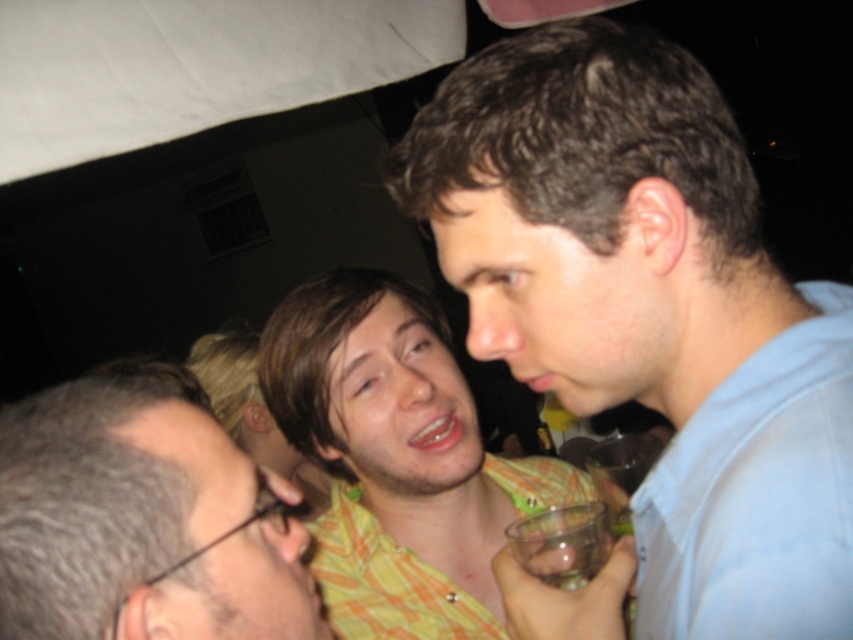
Which is above, blue cotton shirt at center or transparent plastic wine glass at lower center?

blue cotton shirt at center is above.

Does blue cotton shirt at center have a greater width compared to transparent plastic wine glass at lower center?

Yes.

Where is `blue cotton shirt at center`? blue cotton shirt at center is located at coordinates (650, 310).

Can you confirm if gray hair at lower left is positioned above transparent plastic wine glass at lower center?

Yes.

Who is more distant from viewer, (138, 592) or (584, 582)?

The point (584, 582) is behind.

Locate an element on the screen. This screenshot has height=640, width=853. gray hair at lower left is located at coordinates (138, 522).

What do you see at coordinates (397, 458) in the screenshot? I see `yellow plaid shirt at center` at bounding box center [397, 458].

Measure the distance between yellow plaid shirt at center and transparent plastic wine glass at lower center.

A distance of 8.97 inches exists between yellow plaid shirt at center and transparent plastic wine glass at lower center.

What do you see at coordinates (397, 458) in the screenshot? I see `yellow plaid shirt at center` at bounding box center [397, 458].

Find the location of a particular element. The height and width of the screenshot is (640, 853). yellow plaid shirt at center is located at coordinates (397, 458).